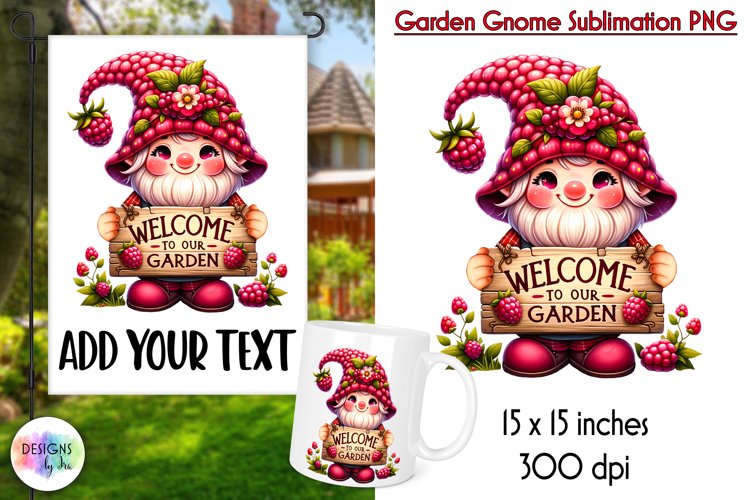
Find the location of a particular element. brick chimney is located at coordinates (248, 22).